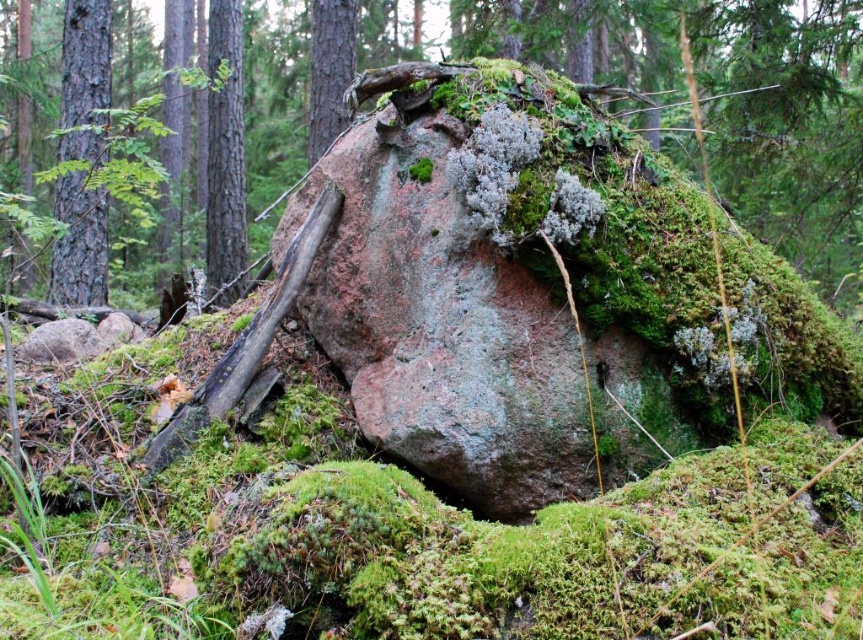
You are standing at the edge of the forest and want to reach the green mossy rock at center. According to the coordinates provided, in which direction should you move from your current position to reach it?

The green mossy rock at center is located at coordinates point (788,125), so you should move towards the lower left direction to reach it.

You are a hiker who wants to place a 5 feet long wooden plank between the brown wood tree at center and the green mossy tree trunk at upper center. Will the plank fit between them?

The brown wood tree at center and green mossy tree trunk at upper center are 5.12 feet apart from each other. Since the plank is 5 feet long, it will fit between them with 0.12 feet of extra space remaining.